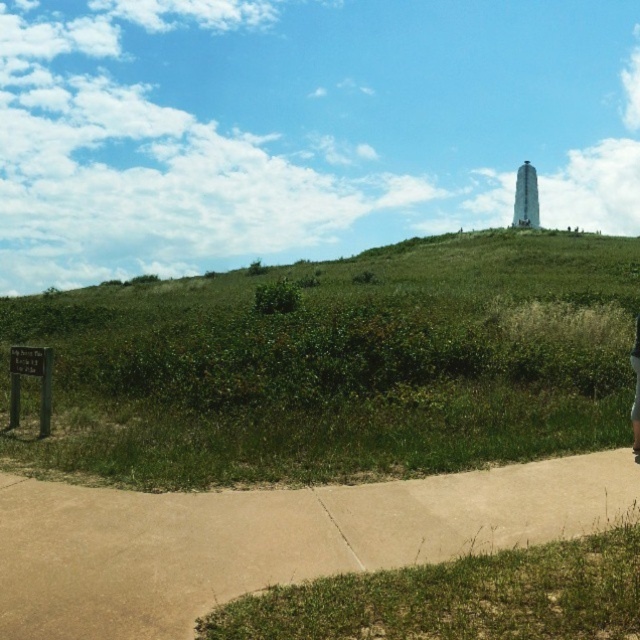
You are standing at the bottom of the green grassy hill at upper center and want to walk to the beige concrete sidewalk at lower center. Which direction should you head to reach the sidewalk?

The green grassy hill at upper center is positioned on the left side of the beige concrete sidewalk at lower center, so you should head to the right to reach the sidewalk.

You are standing at the point marked by the coordinate point (337, 365) in the image. What is the terrain like around you?

The terrain around the point (337, 365) is green grassy hill at upper center, which is covered with green vegetation and some dry golden brown grasses.